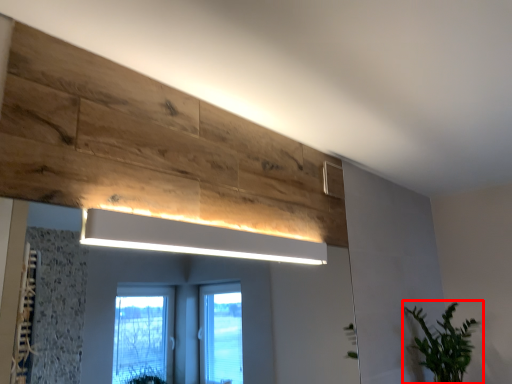
Question: In this image, where is houseplant (annotated by the red box) located relative to light fixture?

Choices:
 (A) left
 (B) right

Answer: (B)